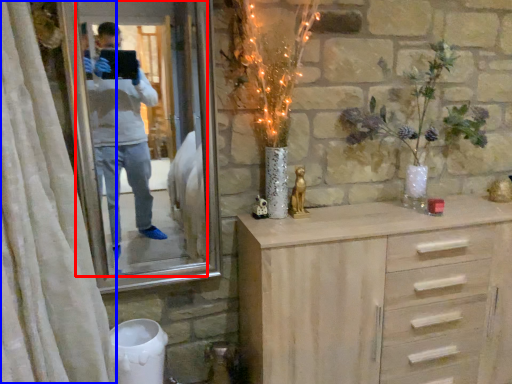
Question: Among these objects, which one is nearest to the camera, mirror (highlighted by a red box) or curtain (highlighted by a blue box)?

Choices:
 (A) mirror
 (B) curtain

Answer: (B)